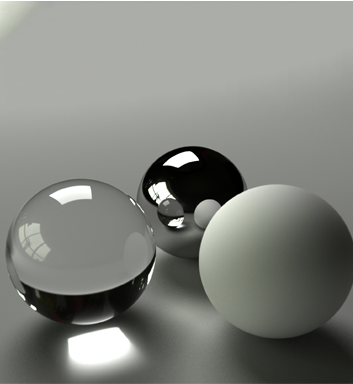
Find the location of a particular element. The width and height of the screenshot is (353, 384). light is located at coordinates (77, 348).